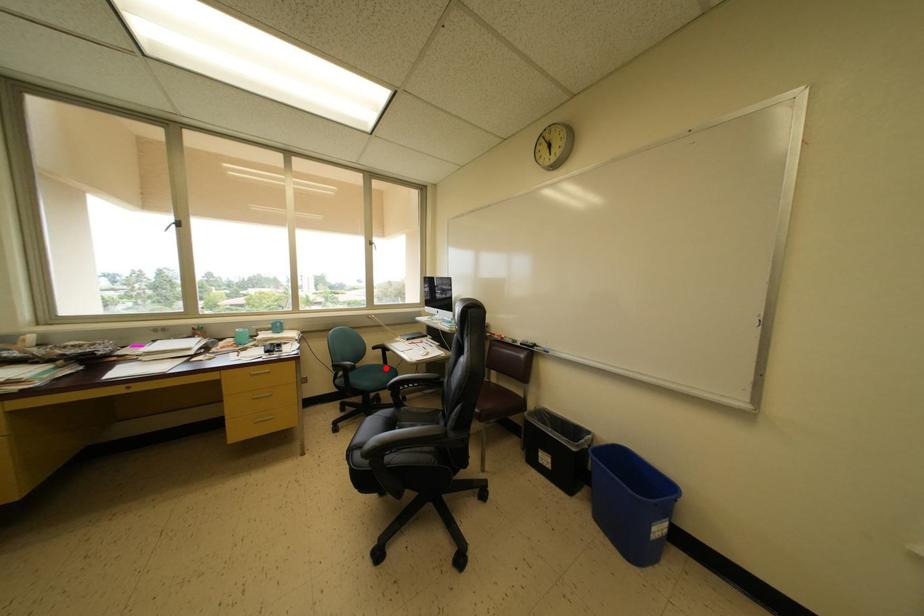
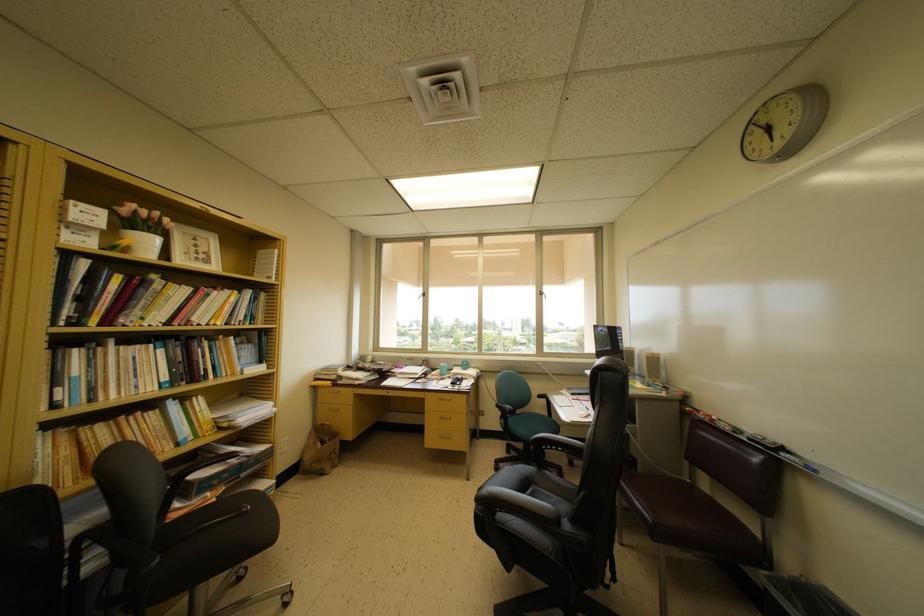
Where in the second image is the point corresponding to the highlighted location from the first image?

(551, 419)